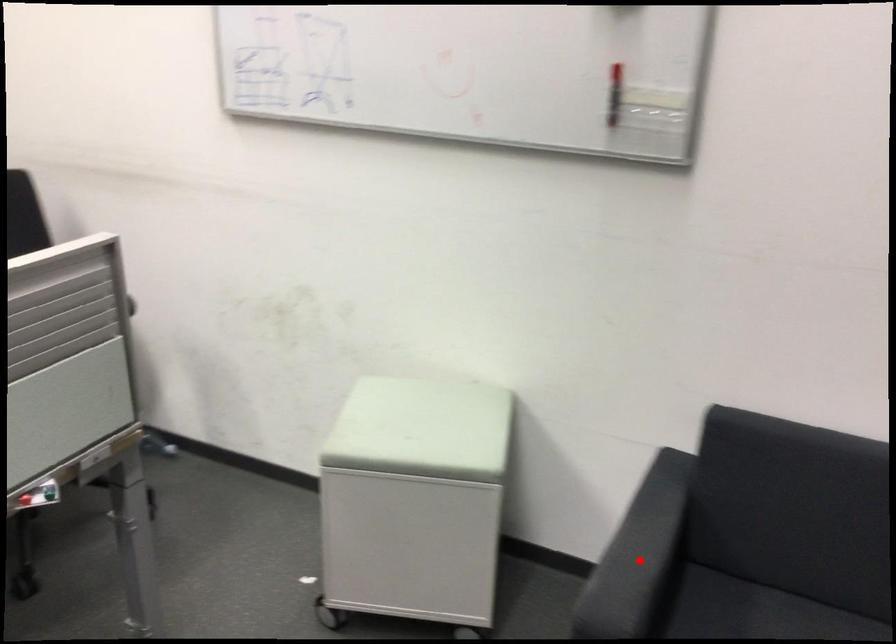
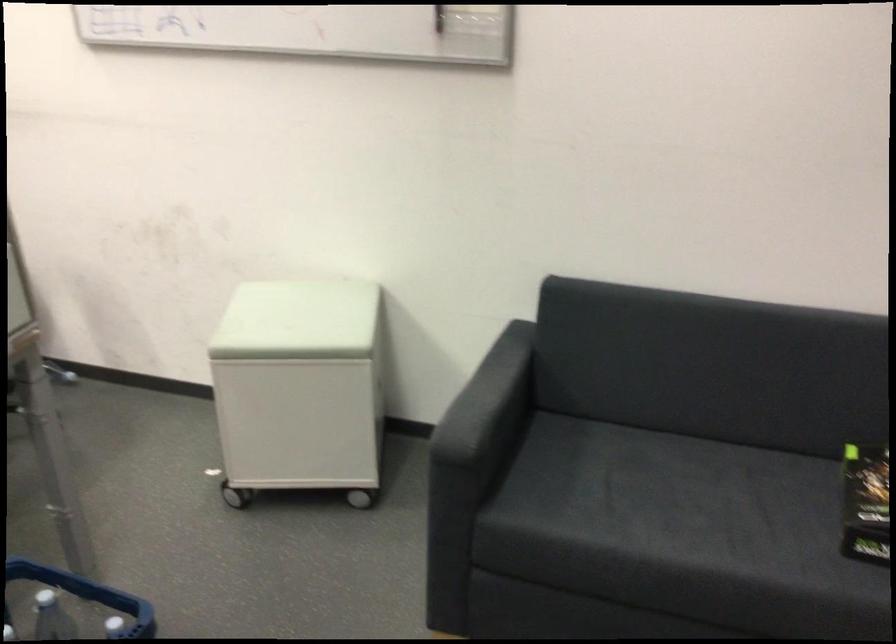
Locate, in the second image, the point that corresponds to the highlighted location in the first image.

(487, 401)